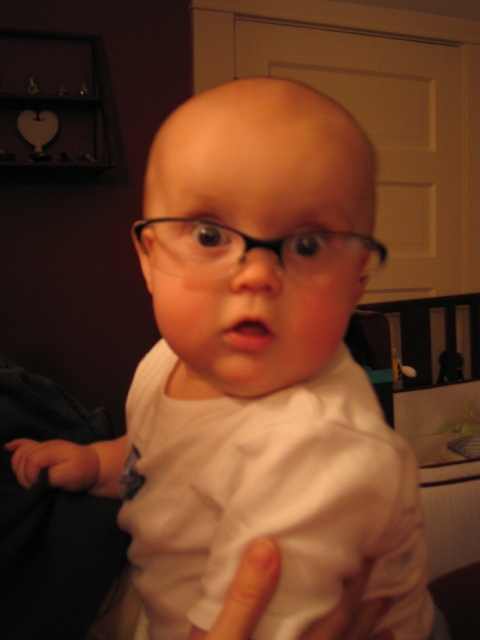
Question: Can you confirm if white soft hand at lower left is bigger than white matte finger at lower center?

Choices:
 (A) yes
 (B) no

Answer: (A)

Question: Does white soft hand at lower left have a greater width compared to white matte finger at lower center?

Choices:
 (A) yes
 (B) no

Answer: (A)

Question: Is white soft hand at lower left wider than white matte finger at lower center?

Choices:
 (A) no
 (B) yes

Answer: (B)

Question: Which point is closer to the camera?

Choices:
 (A) white soft hand at lower left
 (B) white matte finger at lower center

Answer: (B)

Question: Among these points, which one is farthest from the camera?

Choices:
 (A) (243, 568)
 (B) (28, 483)

Answer: (B)

Question: Which point is closer to the camera?

Choices:
 (A) (263, 602)
 (B) (87, 444)

Answer: (A)